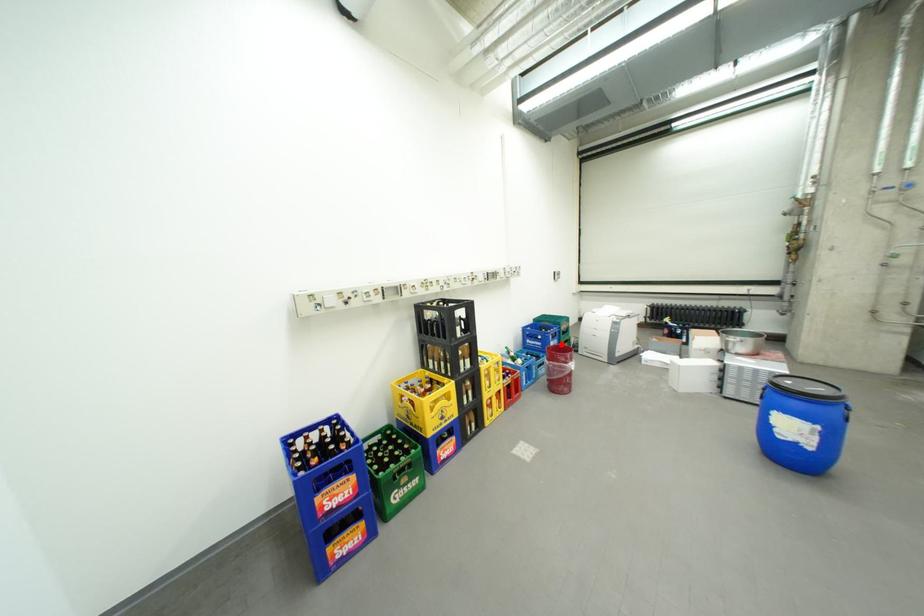
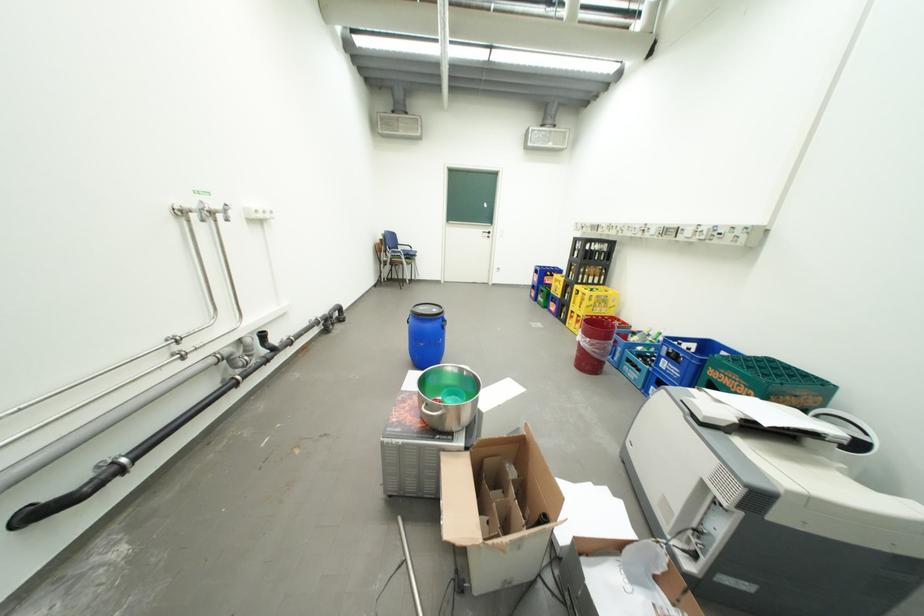
In the second image, find the point that corresponds to the highlighted location in the first image.

(674, 361)